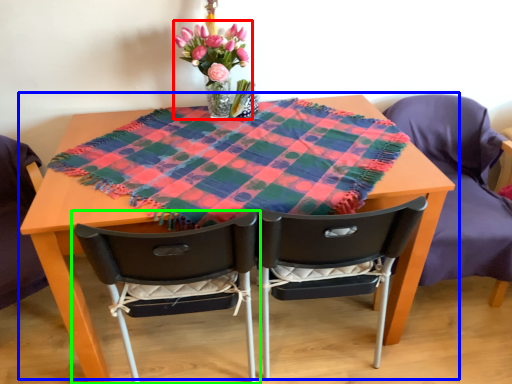
Question: Considering the real-world distances, which object is farthest from floral arrangement (highlighted by a red box)? table (highlighted by a blue box) or chair (highlighted by a green box)?

Choices:
 (A) table
 (B) chair

Answer: (B)